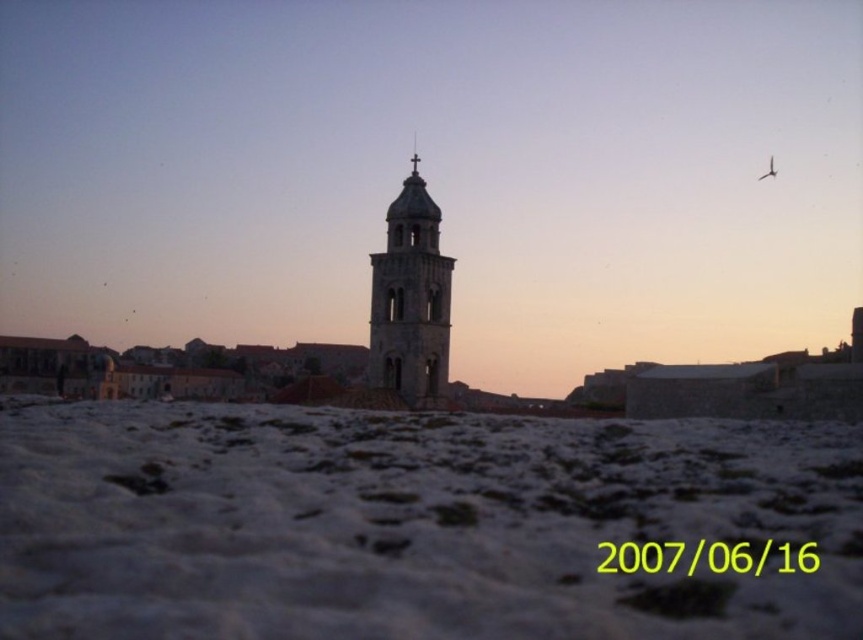
You are an architect designing a new sculpture to be placed in the open area with white powdery snow at lower center and smooth stone bell tower at center. The sculpture needs to be smaller than both objects. Which object should you use as the reference for the maximum size of the sculpture?

The sculpture needs to be smaller than both the white powdery snow at lower center and the smooth stone bell tower at center. Since the white powdery snow at lower center is bigger than the smooth stone bell tower at center, the sculpture should be smaller than the smaller of the two, which is the smooth stone bell tower at center. Therefore, use the smooth stone bell tower at center as the reference for the maximum size.

Based on the photo, you are standing on the white powdery snow at lower center and want to walk towards the smooth stone bell tower at center. Is the tower directly above you, or do you need to walk forward to reach it?

The white powdery snow at lower center is positioned under the smooth stone bell tower at center, so the tower is directly above you and you don not need to walk forward to reach it.